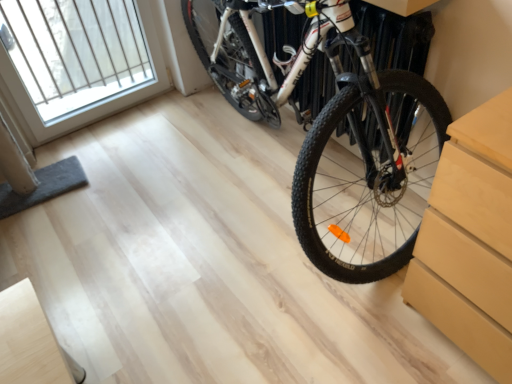
Question: From the image's perspective, is white glass window at upper left below shiny white bicycle at center?

Choices:
 (A) no
 (B) yes

Answer: (A)

Question: From a real-world perspective, is white glass window at upper left located higher than shiny white bicycle at center?

Choices:
 (A) no
 (B) yes

Answer: (A)

Question: Considering the relative sizes of white glass window at upper left and shiny white bicycle at center in the image provided, is white glass window at upper left thinner than shiny white bicycle at center?

Choices:
 (A) no
 (B) yes

Answer: (B)

Question: From the image's perspective, is white glass window at upper left above shiny white bicycle at center?

Choices:
 (A) yes
 (B) no

Answer: (A)

Question: Is white glass window at upper left at the left side of shiny white bicycle at center?

Choices:
 (A) no
 (B) yes

Answer: (B)

Question: Does white glass window at upper left have a smaller size compared to shiny white bicycle at center?

Choices:
 (A) yes
 (B) no

Answer: (A)

Question: From a real-world perspective, is shiny white bicycle at center over white glass window at upper left?

Choices:
 (A) no
 (B) yes

Answer: (B)

Question: Is white glass window at upper left at the back of shiny white bicycle at center?

Choices:
 (A) yes
 (B) no

Answer: (B)

Question: Can you confirm if shiny white bicycle at center is shorter than white glass window at upper left?

Choices:
 (A) yes
 (B) no

Answer: (B)

Question: From a real-world perspective, is shiny white bicycle at center positioned under white glass window at upper left based on gravity?

Choices:
 (A) no
 (B) yes

Answer: (A)

Question: Can you confirm if shiny white bicycle at center is positioned to the left of white glass window at upper left?

Choices:
 (A) yes
 (B) no

Answer: (B)

Question: Does shiny white bicycle at center lie in front of white glass window at upper left?

Choices:
 (A) yes
 (B) no

Answer: (A)

Question: Is point (420, 185) closer or farther from the camera than point (130, 51)?

Choices:
 (A) farther
 (B) closer

Answer: (B)